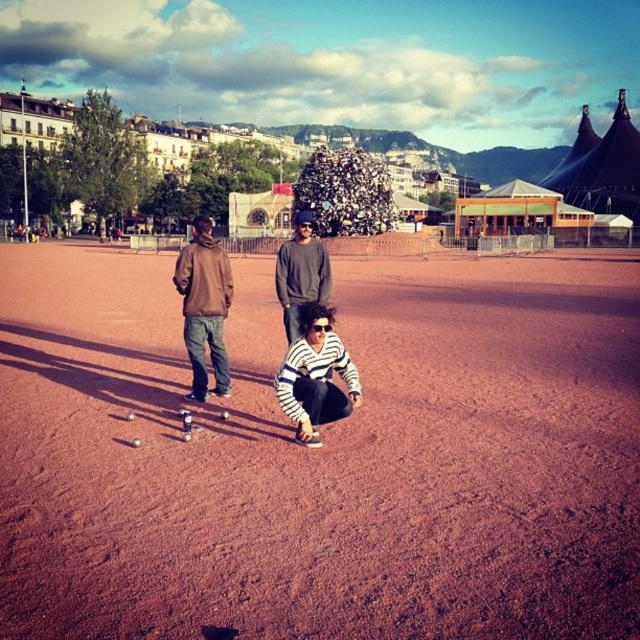
You are a photographer trying to capture the striped fabric at center and the gray sweater at center in the same frame. Based on their positions, which one should you focus on first to ensure both are in focus?

The striped fabric at center is below gray sweater at center, so you should focus on the gray sweater at center first to ensure both are in focus.

You are a photographer trying to capture a wide shot of the scene. You notice the brown matte jacket at left and the gray sweater at center. Which clothing item would require more space in the frame to fully capture its width?

The brown matte jacket at left has a greater width than the gray sweater at center, so it would require more space in the frame to fully capture its width.